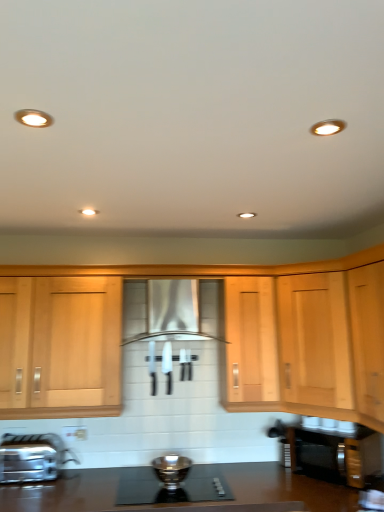
Question: From the image's perspective, is satin silver bowl at center positioned above or below light wood cabinet at right?

Choices:
 (A) below
 (B) above

Answer: (A)

Question: Is satin silver bowl at center wider or thinner than light wood cabinet at right?

Choices:
 (A) thin
 (B) wide

Answer: (A)

Question: Which is farther from the satin silver range hood at center?

Choices:
 (A) light wood cabinet at right
 (B) white plastic electric outlet at lower center
 (C) black glass gas stove at center
 (D) satin nickel faucet at lower left
 (E) satin silver bowl at center

Answer: (D)

Question: Which is nearer to the satin nickel faucet at lower left?

Choices:
 (A) white plastic electric outlet at lower center
 (B) satin silver bowl at center
 (C) satin silver range hood at center
 (D) black glass gas stove at center
 (E) light wood cabinet at right

Answer: (A)